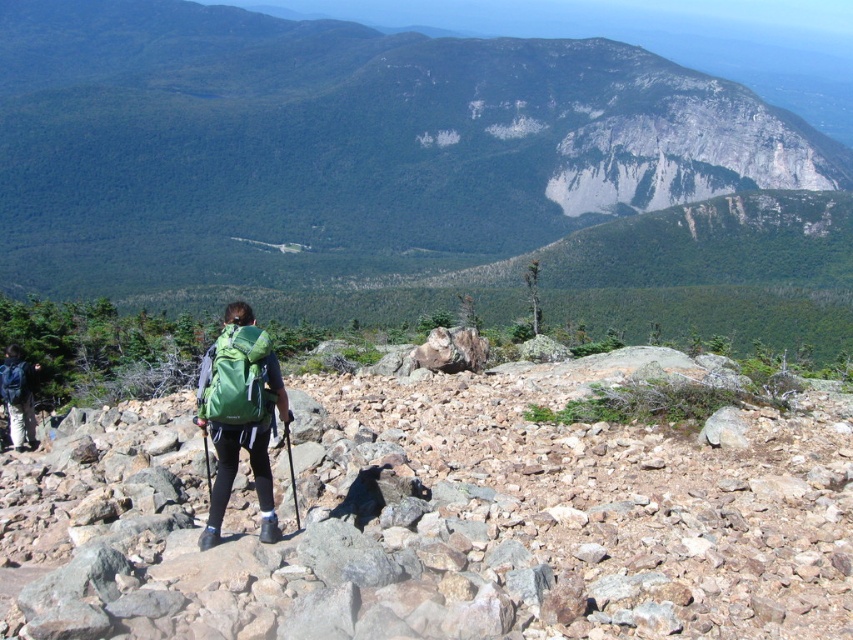
Does point (456, 147) come in front of point (28, 433)?

That is False.

Where is `green rock at center`? The width and height of the screenshot is (853, 640). green rock at center is located at coordinates (364, 152).

Which is in front, point (718, 88) or point (15, 404)?

Positioned in front is point (15, 404).

Locate an element on the screen. green rock at center is located at coordinates (364, 152).

Is point (767, 572) farther from viewer compared to point (254, 419)?

That is False.

Who is taller, rusty stone boulder at center or green fabric backpack at center?

With more height is green fabric backpack at center.

You are a GUI agent. You are given a task and a screenshot of the screen. Output one action in this format:
    pyautogui.click(x=<x>, y=<y>)
    Task: Click on the rusty stone boulder at center
    The width and height of the screenshot is (853, 640).
    Given the screenshot: What is the action you would take?
    pyautogui.click(x=442, y=516)

Can you confirm if green rock at center is bigger than rusty stone boulder at center?

Indeed, green rock at center has a larger size compared to rusty stone boulder at center.

Is point (241, 68) farther from camera compared to point (412, 451)?

Yes, it is.

In order to click on green rock at center in this screenshot , I will do `click(364, 152)`.